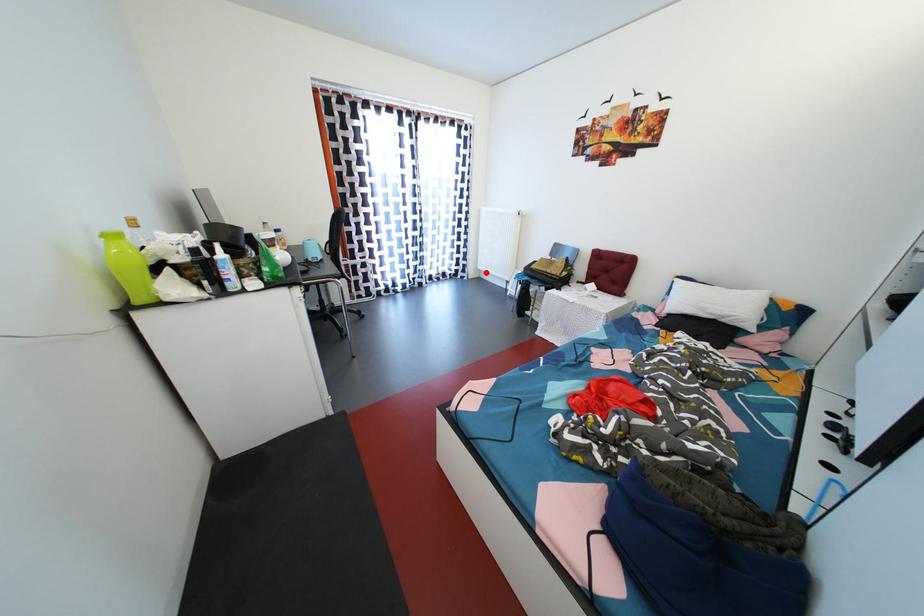
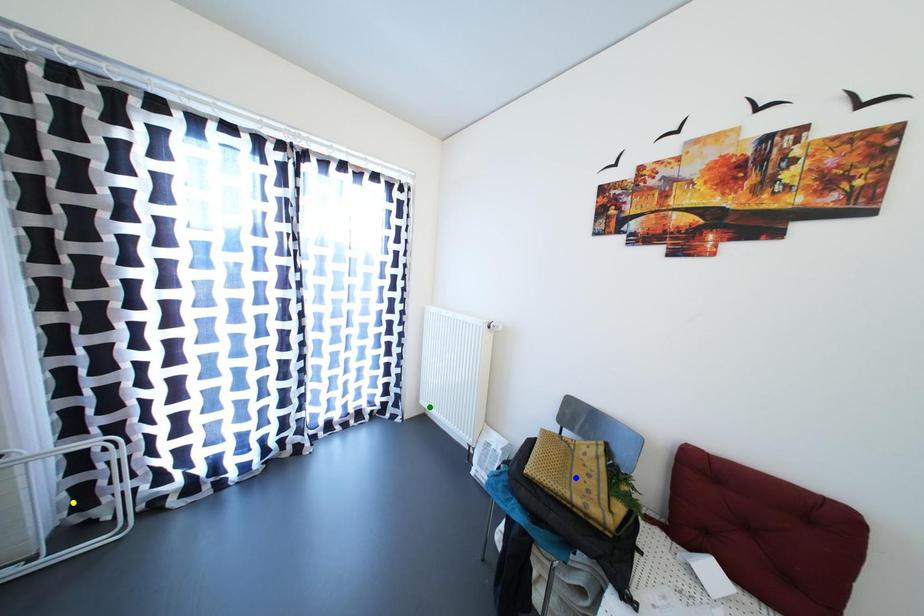
Question: I am providing you with two images of the same scene from different viewpoints. A red point is marked on the first image. You are given multiple points on the second image. Which point in image 2 is actually the same real-world point as the red point in image 1?

Choices:
 (A) yellow point
 (B) green point
 (C) blue point

Answer: (B)